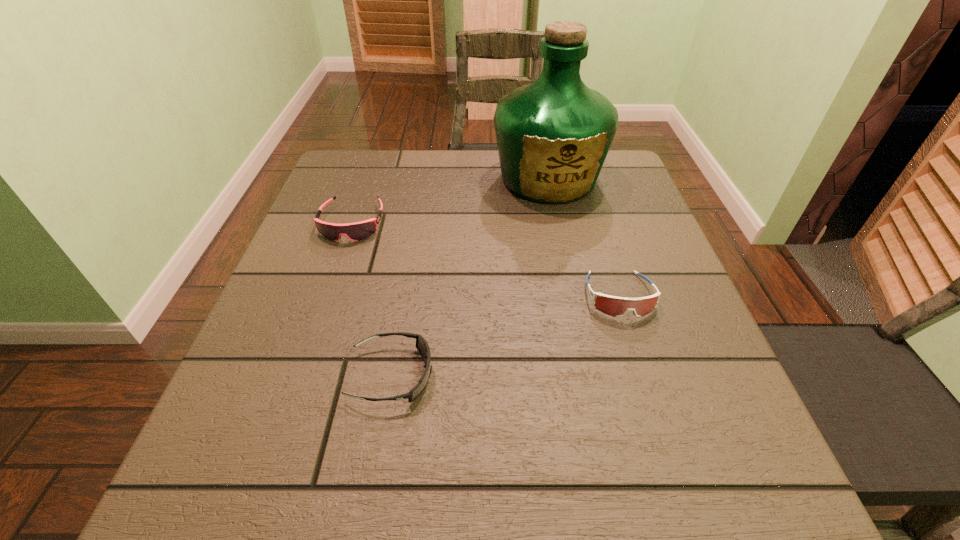
Where is `free space between the second goggles from right to left and the leftmost object`? The width and height of the screenshot is (960, 540). free space between the second goggles from right to left and the leftmost object is located at coordinates (372, 299).

You are a GUI agent. You are given a task and a screenshot of the screen. Output one action in this format:
    pyautogui.click(x=<x>, y=<y>)
    Task: Click on the vacant space that's between the nearest object and the leftmost object
    
    Given the screenshot: What is the action you would take?
    pyautogui.click(x=372, y=299)

Where is `free space between the leftmost goggles and the second nearest object`? This screenshot has width=960, height=540. free space between the leftmost goggles and the second nearest object is located at coordinates (486, 259).

Where is `object that is the nearest to the second goggles from left to right`? object that is the nearest to the second goggles from left to right is located at coordinates (357, 231).

Identify which object is the third nearest to the second nearest goggles. Please provide its 2D coordinates. Your answer should be formatted as a tuple, i.e. [(x, y)], where the tuple contains the x and y coordinates of a point satisfying the conditions above.

[(357, 231)]

Locate which goggles is the second closest to the second goggles from right to left. Please provide its 2D coordinates. Your answer should be formatted as a tuple, i.e. [(x, y)], where the tuple contains the x and y coordinates of a point satisfying the conditions above.

[(614, 306)]

In order to click on goggles that is the third closest one to the liquor in this screenshot , I will do `click(422, 346)`.

I want to click on blank space that satisfies the following two spatial constraints: 1. on the label side of the tallest object; 2. on the lenses of the nearest goggles, so click(x=589, y=375).